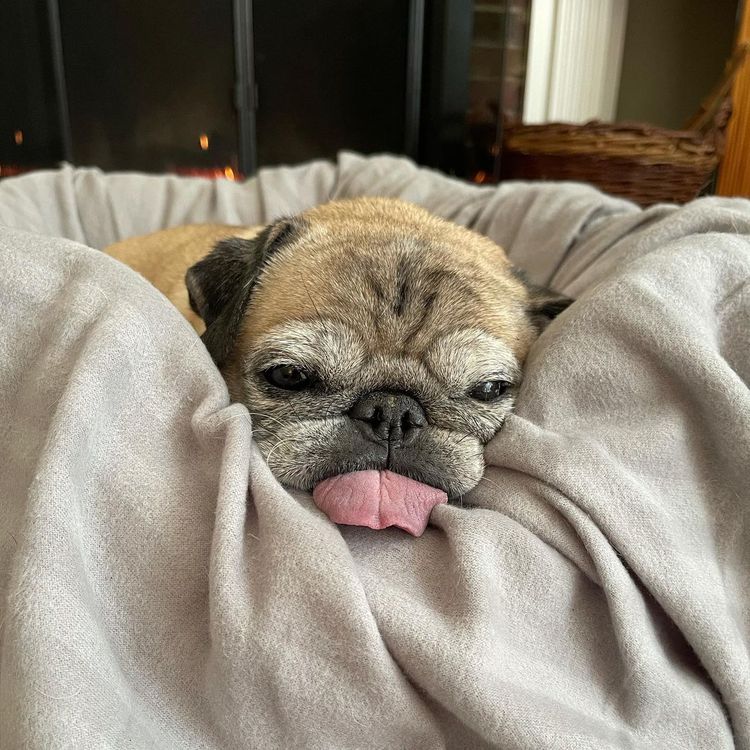
Where is `top of tan blanket above and behind puppy in center`? Image resolution: width=750 pixels, height=750 pixels. top of tan blanket above and behind puppy in center is located at coordinates point(49,198), point(354,172), point(577,216), point(615,226), point(98,198).